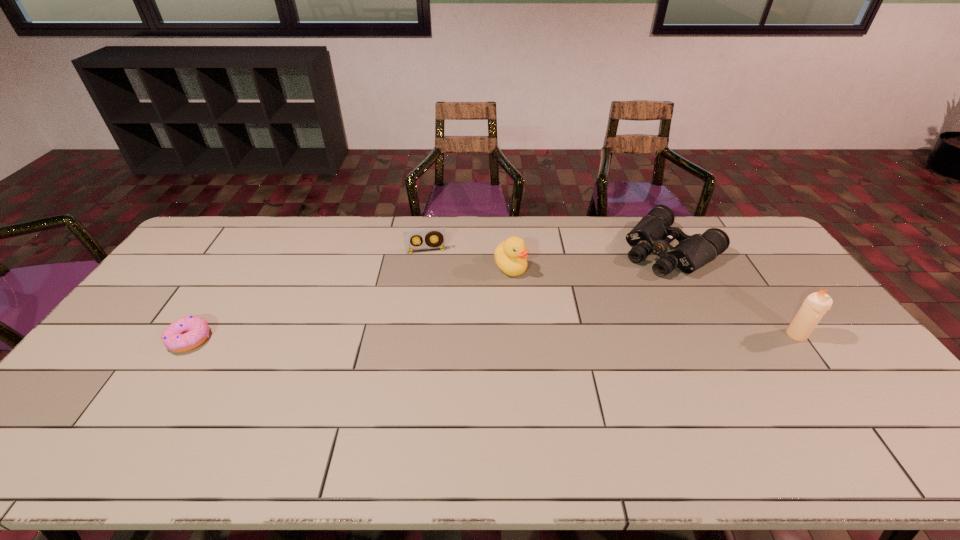
This screenshot has width=960, height=540. I want to click on free space on the desktop that is between the shortest object and the candle and is positioned through the eyepieces of the binoculars, so click(563, 336).

Locate an element on the screen. Image resolution: width=960 pixels, height=540 pixels. free space on the desktop that is between the doughnut and the rightmost object and is positioned at the front of the fourth object from right to left with visible reels is located at coordinates (435, 337).

Find the location of a particular element. The height and width of the screenshot is (540, 960). vacant space on the desktop that is between the doughnut and the candle and is positioned at the beak of the duck is located at coordinates (565, 336).